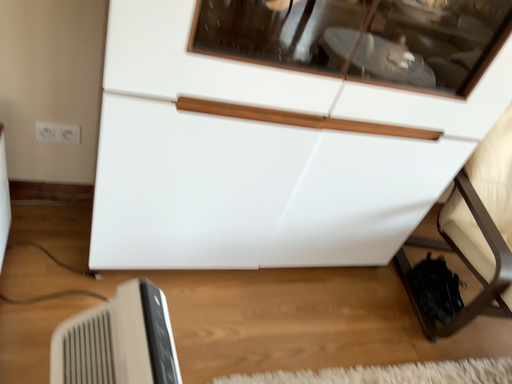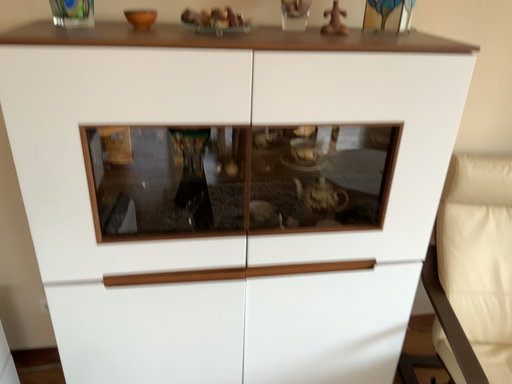
Question: How did the camera likely rotate when shooting the video?

Choices:
 (A) rotated left
 (B) rotated right

Answer: (A)